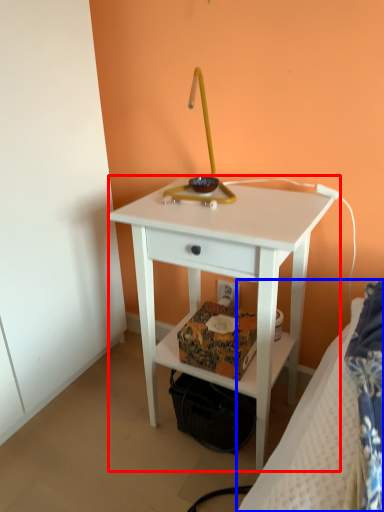
Question: Which object appears farthest to the camera in this image, nightstand (highlighted by a red box) or bed (highlighted by a blue box)?

Choices:
 (A) nightstand
 (B) bed

Answer: (A)